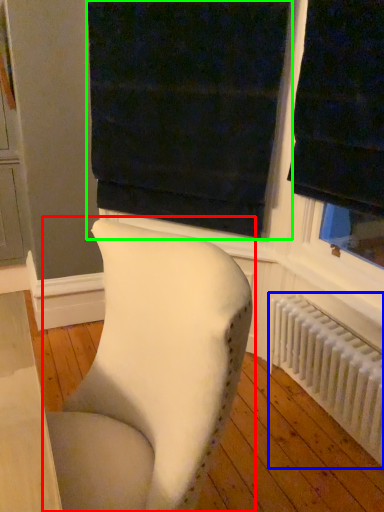
Question: Which object is positioned closest to chair (highlighted by a red box)? Select from radiator (highlighted by a blue box) and curtain (highlighted by a green box).

Choices:
 (A) radiator
 (B) curtain

Answer: (A)